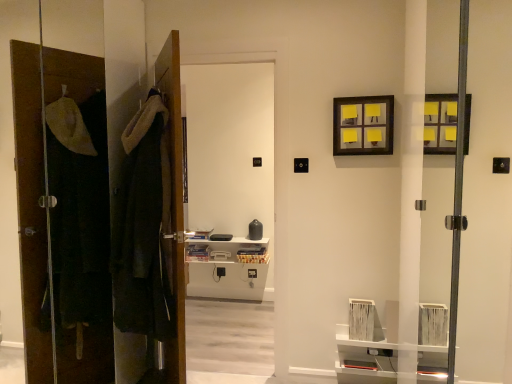
Question: Is velvet-like dark green robe at left positioned behind brown wooden door at left, marked as the first door in a left-to-right arrangement?

Choices:
 (A) no
 (B) yes

Answer: (B)

Question: Is velvet-like dark green robe at left not close to brown wooden door at left, marked as the first door in a left-to-right arrangement?

Choices:
 (A) yes
 (B) no

Answer: (B)

Question: Is velvet-like dark green robe at left oriented away from brown wooden door at left, marked as the first door in a left-to-right arrangement?

Choices:
 (A) yes
 (B) no

Answer: (A)

Question: From a real-world perspective, is velvet-like dark green robe at left located beneath brown wooden door at left, which appears as the second door when viewed from the right?

Choices:
 (A) yes
 (B) no

Answer: (A)

Question: Is velvet-like dark green robe at left completely or partially outside of brown wooden door at left, which appears as the second door when viewed from the right?

Choices:
 (A) yes
 (B) no

Answer: (A)

Question: Can you confirm if velvet-like dark green robe at left is wider than brown wooden door at left, marked as the first door in a left-to-right arrangement?

Choices:
 (A) yes
 (B) no

Answer: (A)

Question: Considering the relative sizes of velvet-like dark green robe at left and wooden door at center, marked as the 2th door in a left-to-right arrangement, in the image provided, is velvet-like dark green robe at left taller than wooden door at center, marked as the 2th door in a left-to-right arrangement,?

Choices:
 (A) yes
 (B) no

Answer: (B)

Question: Is velvet-like dark green robe at left bigger than wooden door at center, acting as the 1th door starting from the right?

Choices:
 (A) yes
 (B) no

Answer: (A)

Question: Is velvet-like dark green robe at left placed right next to wooden door at center, acting as the 1th door starting from the right?

Choices:
 (A) yes
 (B) no

Answer: (B)

Question: Considering the relative positions of velvet-like dark green robe at left and wooden door at center, acting as the 1th door starting from the right, in the image provided, is velvet-like dark green robe at left to the left of wooden door at center, acting as the 1th door starting from the right, from the viewer's perspective?

Choices:
 (A) no
 (B) yes

Answer: (B)

Question: Is velvet-like dark green robe at left positioned with its back to wooden door at center, marked as the 2th door in a left-to-right arrangement?

Choices:
 (A) no
 (B) yes

Answer: (A)

Question: Can wooden door at center, marked as the 2th door in a left-to-right arrangement, be found inside velvet-like dark green robe at left?

Choices:
 (A) no
 (B) yes

Answer: (A)

Question: Is velvet-like dark green robe at left turned away from white glossy door at center?

Choices:
 (A) no
 (B) yes

Answer: (A)